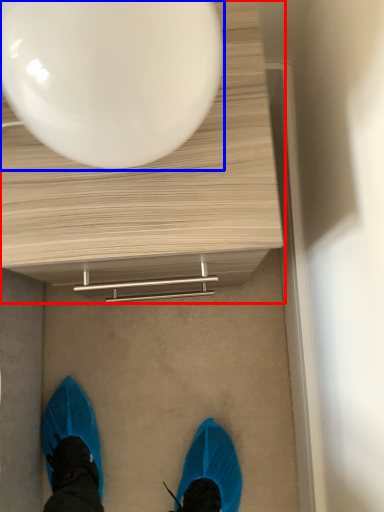
Question: Which object appears closest to the camera in this image, table (highlighted by a red box) or balloon (highlighted by a blue box)?

Choices:
 (A) table
 (B) balloon

Answer: (B)